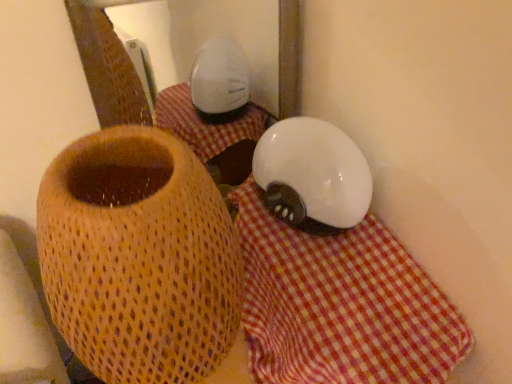
Question: Does white checkered cloth at center have a larger size compared to matte woven vase at center?

Choices:
 (A) no
 (B) yes

Answer: (A)

Question: Is white checkered cloth at center thinner than matte woven vase at center?

Choices:
 (A) no
 (B) yes

Answer: (A)

Question: Is the depth of white checkered cloth at center greater than that of matte woven vase at center?

Choices:
 (A) yes
 (B) no

Answer: (A)

Question: Is white checkered cloth at center positioned beyond the bounds of matte woven vase at center?

Choices:
 (A) yes
 (B) no

Answer: (A)

Question: Is white checkered cloth at center positioned in front of matte woven vase at center?

Choices:
 (A) yes
 (B) no

Answer: (B)

Question: Can you see white checkered cloth at center touching matte woven vase at center?

Choices:
 (A) no
 (B) yes

Answer: (A)

Question: Does matte woven vase at center lie behind white checkered cloth at center?

Choices:
 (A) no
 (B) yes

Answer: (A)

Question: Is matte woven vase at center not within white checkered cloth at center?

Choices:
 (A) no
 (B) yes

Answer: (B)

Question: Does matte woven vase at center have a greater height compared to white checkered cloth at center?

Choices:
 (A) yes
 (B) no

Answer: (A)

Question: Considering the relative sizes of matte woven vase at center and white checkered cloth at center in the image provided, is matte woven vase at center thinner than white checkered cloth at center?

Choices:
 (A) no
 (B) yes

Answer: (B)

Question: Is matte woven vase at center wider than white checkered cloth at center?

Choices:
 (A) no
 (B) yes

Answer: (A)

Question: Is matte woven vase at center oriented away from white checkered cloth at center?

Choices:
 (A) no
 (B) yes

Answer: (A)

Question: In the image, is matte woven vase at center on the left side or the right side of white checkered cloth at center?

Choices:
 (A) right
 (B) left

Answer: (B)